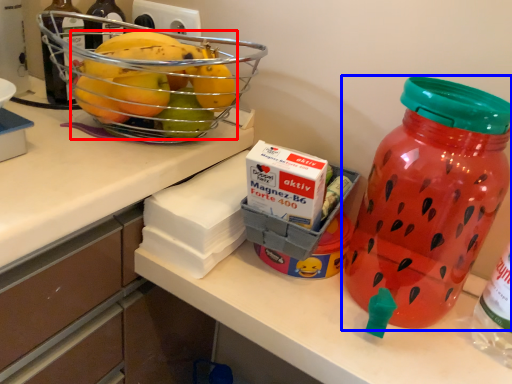
Question: Which of the following is the farthest to the observer, grapefruit (highlighted by a red box) or bottle (highlighted by a blue box)?

Choices:
 (A) grapefruit
 (B) bottle

Answer: (A)